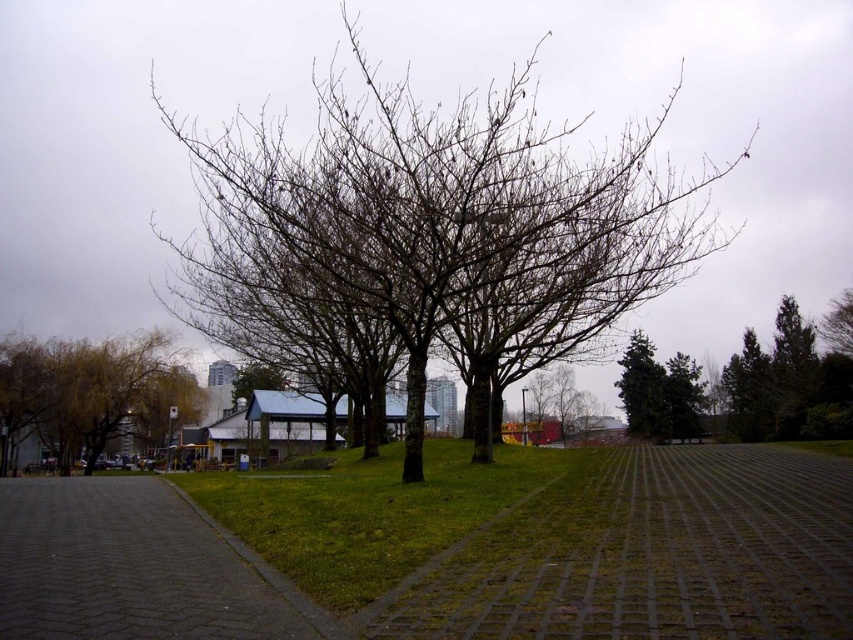
Question: Which of the following is the farthest from the observer?

Choices:
 (A) (447, 616)
 (B) (666, 397)
 (C) (428, 524)
 (D) (51, 432)

Answer: (B)

Question: Which object is farther from the camera taking this photo?

Choices:
 (A) green grass at center
 (B) gray concrete path at center
 (C) green textured tree at upper right

Answer: (C)

Question: Does bare branches at center have a greater width compared to green textured tree at upper right?

Choices:
 (A) yes
 (B) no

Answer: (A)

Question: Where is bare branches at center located in relation to green textured tree at upper right in the image?

Choices:
 (A) above
 (B) below

Answer: (A)

Question: Estimate the real-world distances between objects in this image. Which object is closer to the green textured tree at upper right?

Choices:
 (A) bare branches at center
 (B) green leafy tree at left

Answer: (A)

Question: Observing the image, what is the correct spatial positioning of dark gray cobblestone pavement at lower left in reference to green grass at center?

Choices:
 (A) right
 (B) left

Answer: (B)